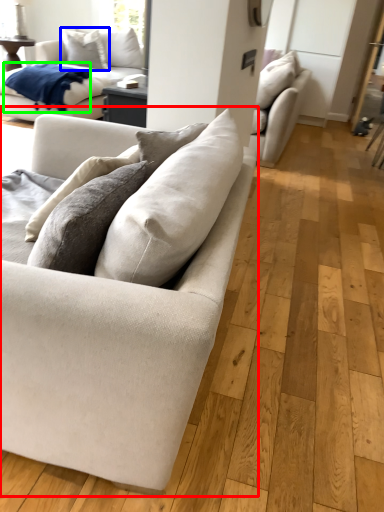
Question: Based on their relative distances, which object is farther from studio couch (highlighted by a red box)? Choose from pillow (highlighted by a blue box) and blanket (highlighted by a green box).

Choices:
 (A) pillow
 (B) blanket

Answer: (A)